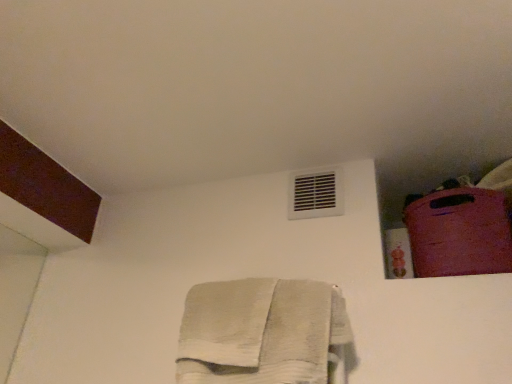
Question: From a real-world perspective, is white plastic air conditioning at upper center positioned above or below white cotton towel at center?

Choices:
 (A) above
 (B) below

Answer: (A)

Question: Is white plastic air conditioning at upper center taller or shorter than white cotton towel at center?

Choices:
 (A) tall
 (B) short

Answer: (B)

Question: Considering the real-world distances, which object is closest to the white cotton towel at center?

Choices:
 (A) white plastic air conditioning at upper center
 (B) rubberized pink suitcase at upper right

Answer: (A)

Question: Which object is positioned farthest from the rubberized pink suitcase at upper right?

Choices:
 (A) white cotton towel at center
 (B) white plastic air conditioning at upper center

Answer: (A)